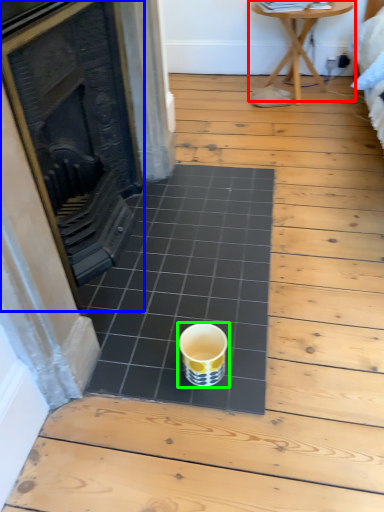
Question: Which object is positioned closest to table (highlighted by a red box)? Select from fireplace (highlighted by a blue box) and coffee cup (highlighted by a green box).

Choices:
 (A) fireplace
 (B) coffee cup

Answer: (A)